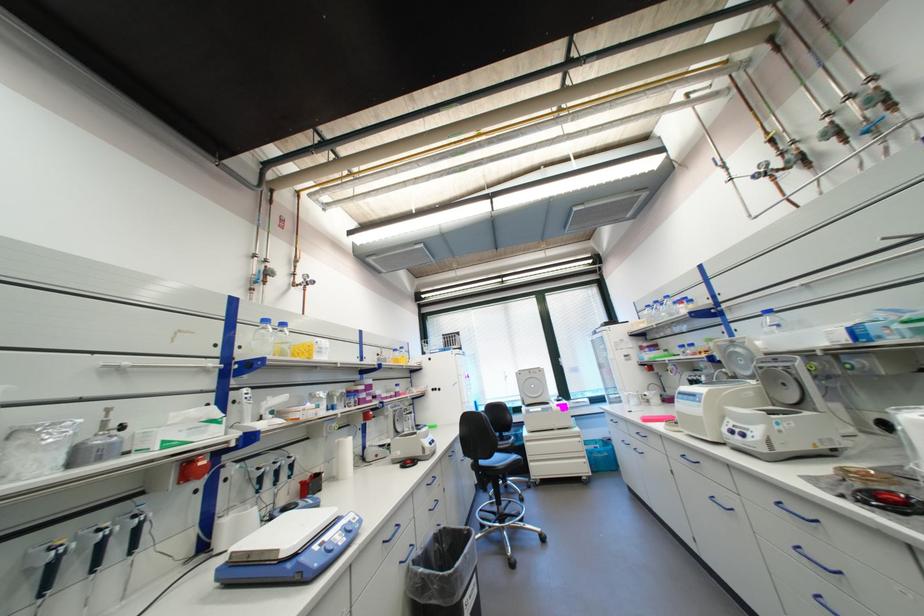
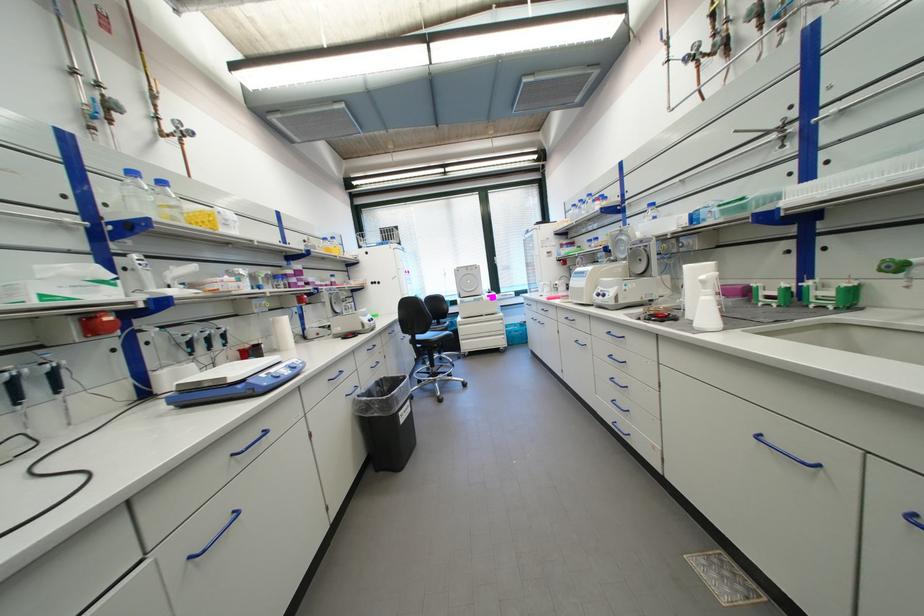
Find the pixel in the second image that matches [808,509] in the first image.

(625, 333)